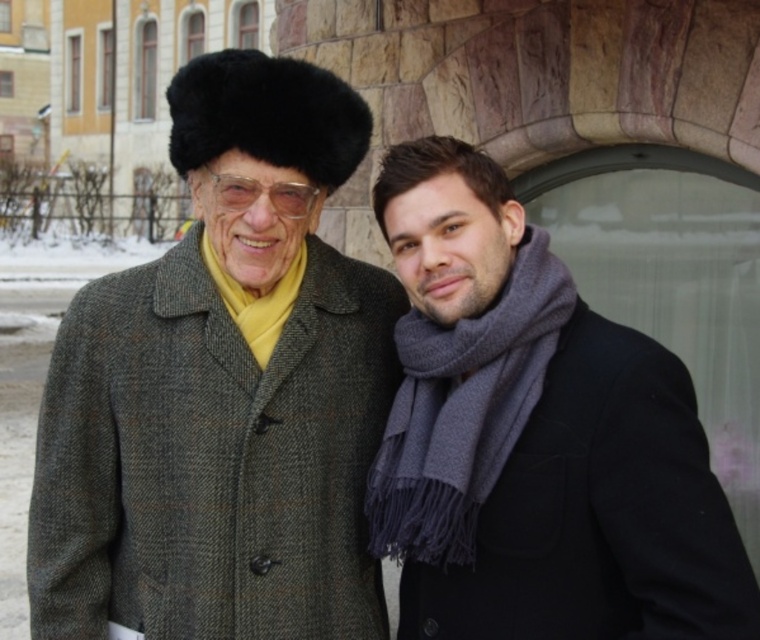
You are a photographer adjusting your camera settings to focus on the gray woolen scarf at right and the transparent plastic glasses at center. Which object should you focus on first to ensure both are in focus?

You should focus on the gray woolen scarf at right first because it is closer to the viewer than the transparent plastic glasses at center, so adjusting focus starting from the closer object ensures both are in focus.

You are a fashion designer analyzing the image. You need to determine if the dark gray wool scarf at right can be worn with the black fur hat at upper left without overlapping. Can you confirm if there is enough space between them?

The dark gray wool scarf at right might be wider than black fur hat at upper left, so there may not be enough space between them to wear them together without overlapping.

Based on the photo, you are a photographer trying to capture a closeup of the dark gray wool scarf at right and the textured wool coat at center. Which object should you focus on first to ensure both are in sharp focus?

The dark gray wool scarf at right is closer to the viewer than the textured wool coat at center, so you should focus on the dark gray wool scarf at right first to ensure both are in sharp focus.